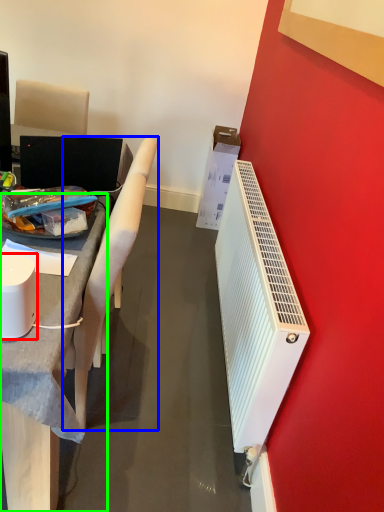
Question: Estimate the real-world distances between objects in this image. Which object is farther from appliance (highlighted by a red box), chair (highlighted by a blue box) or desk (highlighted by a green box)?

Choices:
 (A) chair
 (B) desk

Answer: (A)